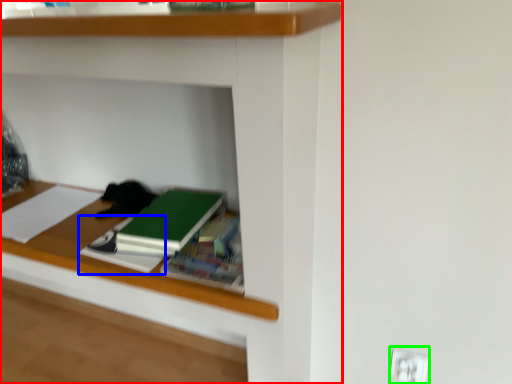
Question: Which object is positioned farthest from shelf (highlighted by a red box)? Select from notebook (highlighted by a blue box) and electric outlet (highlighted by a green box).

Choices:
 (A) notebook
 (B) electric outlet

Answer: (B)